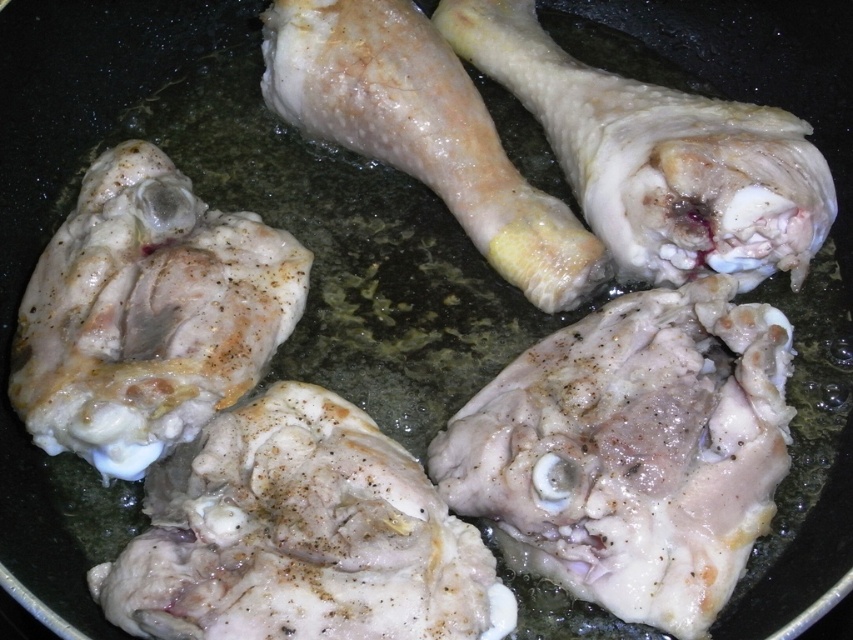
Who is higher up, white matte chicken wing at upper right or white matte chicken wing at center?

Positioned higher is white matte chicken wing at upper right.

Which is more to the right, white matte chicken wing at upper right or white matte chicken wing at center?

From the viewer's perspective, white matte chicken wing at upper right appears more on the right side.

Is point (453, 42) farther from viewer compared to point (363, 68)?

Yes, point (453, 42) is behind point (363, 68).

Where is `white matte chicken wing at upper right`? The height and width of the screenshot is (640, 853). white matte chicken wing at upper right is located at coordinates (659, 156).

Is point (252, 550) less distant than point (480, 36)?

Yes, it is in front of point (480, 36).

Which is behind, point (277, 589) or point (619, 196)?

Positioned behind is point (619, 196).

You are a GUI agent. You are given a task and a screenshot of the screen. Output one action in this format:
    pyautogui.click(x=<x>, y=<y>)
    Task: Click on the white matte chicken thigh at center
    
    Given the screenshot: What is the action you would take?
    pyautogui.click(x=299, y=536)

Who is positioned more to the left, white matte chicken thigh at lower left or white matte chicken wing at upper right?

Positioned to the left is white matte chicken thigh at lower left.

Is white matte chicken thigh at lower left positioned behind white matte chicken wing at upper right?

No, it is not.

Who is more distant from viewer, (73, 230) or (624, 172)?

Positioned behind is point (624, 172).

I want to click on white matte chicken thigh at lower left, so click(x=148, y=314).